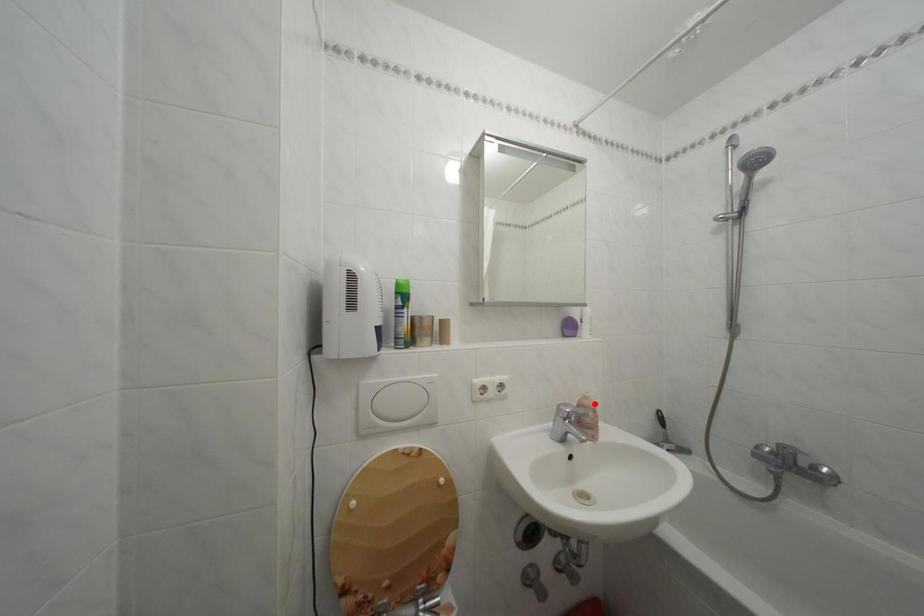
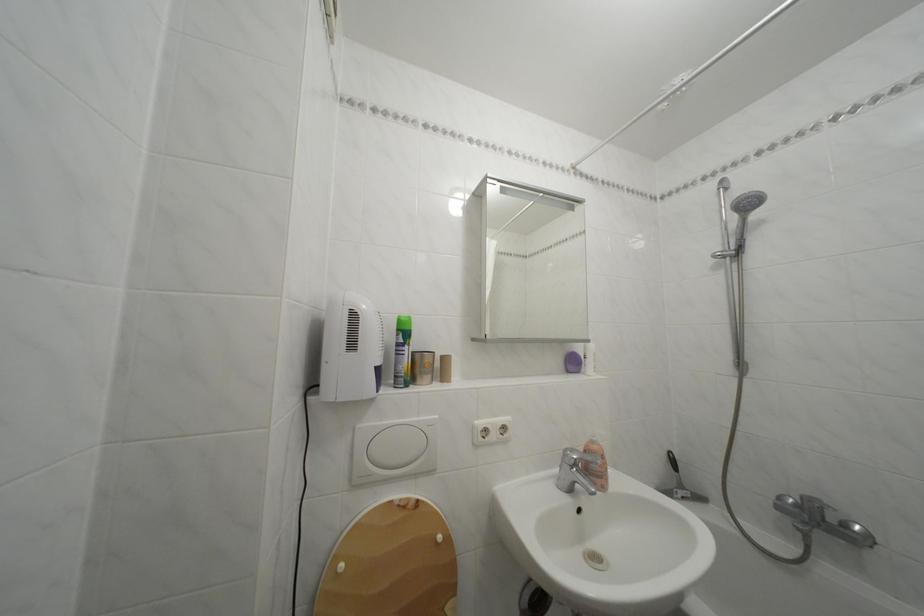
Question: I am providing you with two images of the same scene from different viewpoints. In image1, a red point is highlighted. Considering the same 3D point in image2, which of the following is correct?

Choices:
 (A) It is closer
 (B) It is farther

Answer: (A)